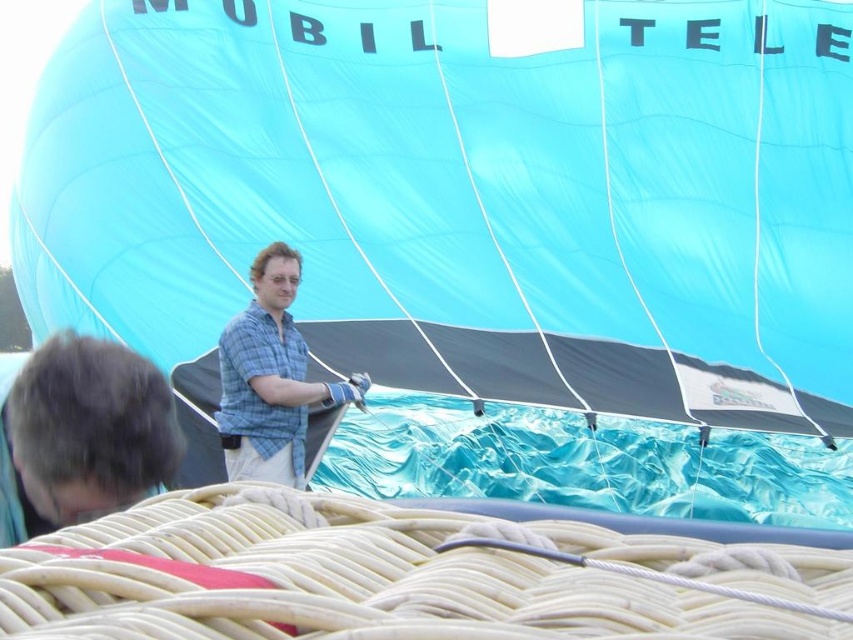
Question: Among these objects, which one is nearest to the camera?

Choices:
 (A) blue glossy balloon at center
 (B) blue plaid shirt at center

Answer: (A)

Question: Estimate the real-world distances between objects in this image. Which object is farther from the blue glossy balloon at center?

Choices:
 (A) checkered fabric shirt at center
 (B) blue plaid shirt at center
 (C) dark blue plaid shirt at center

Answer: (C)

Question: Which object is positioned closest to the blue glossy balloon at center?

Choices:
 (A) blue plaid shirt at center
 (B) checkered fabric shirt at center

Answer: (B)

Question: Does dark blue plaid shirt at center have a greater width compared to checkered fabric shirt at center?

Choices:
 (A) no
 (B) yes

Answer: (B)

Question: Is blue plaid shirt at center positioned in front of checkered fabric shirt at center?

Choices:
 (A) yes
 (B) no

Answer: (A)

Question: In this image, where is dark blue plaid shirt at center located relative to checkered fabric shirt at center?

Choices:
 (A) left
 (B) right

Answer: (A)